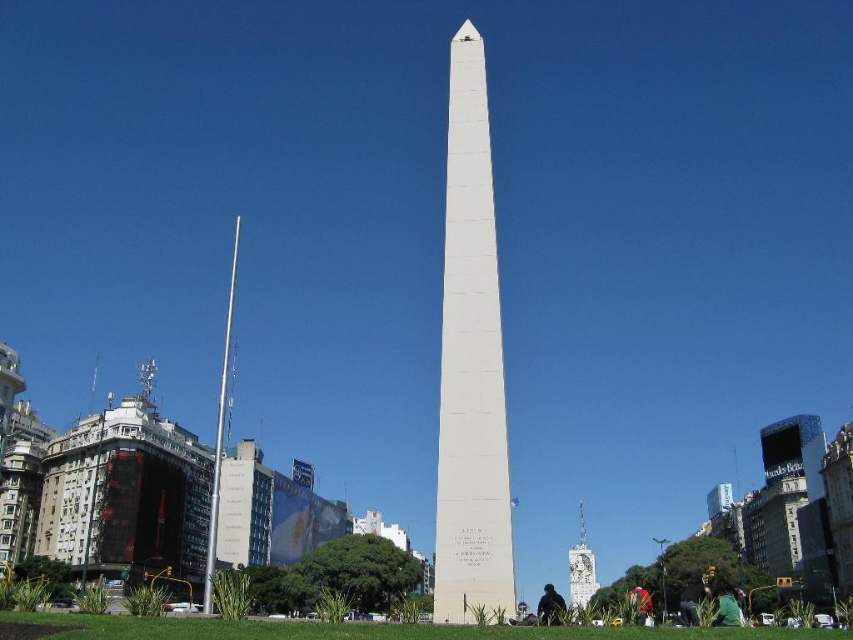
Does green fabric at lower right appear on the left side of red fabric bag at lower right?

No, green fabric at lower right is not to the left of red fabric bag at lower right.

Does green fabric at lower right appear over red fabric bag at lower right?

Yes.

You are a GUI agent. You are given a task and a screenshot of the screen. Output one action in this format:
    pyautogui.click(x=<x>, y=<y>)
    Task: Click on the green fabric at lower right
    Image resolution: width=853 pixels, height=640 pixels.
    Given the screenshot: What is the action you would take?
    pyautogui.click(x=728, y=608)

Where is `green fabric at lower right`? The image size is (853, 640). green fabric at lower right is located at coordinates tap(728, 608).

Does white marble obelisk at center lie behind black fabric at center?

Yes, white marble obelisk at center is further from the viewer.

How much distance is there between white marble obelisk at center and black fabric at center?

The distance of white marble obelisk at center from black fabric at center is 18.76 meters.

This screenshot has width=853, height=640. I want to click on white marble obelisk at center, so click(x=581, y=566).

Is the position of white polished stone obelisk at center less distant than that of black fabric at center?

Yes, white polished stone obelisk at center is in front of black fabric at center.

In the scene shown: Does white polished stone obelisk at center appear on the right side of black fabric at center?

In fact, white polished stone obelisk at center is to the left of black fabric at center.

You are a GUI agent. You are given a task and a screenshot of the screen. Output one action in this format:
    pyautogui.click(x=<x>, y=<y>)
    Task: Click on the white polished stone obelisk at center
    The image size is (853, 640).
    Given the screenshot: What is the action you would take?
    pyautogui.click(x=469, y=365)